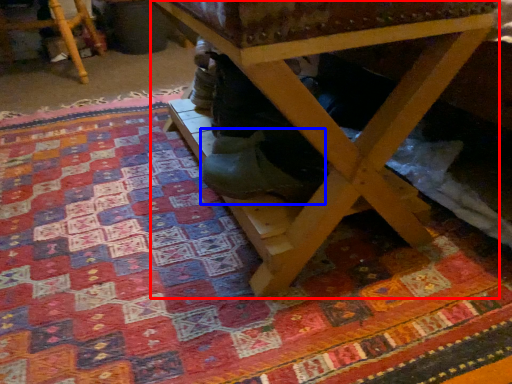
Question: Among these objects, which one is nearest to the camera, table (highlighted by a red box) or shoe (highlighted by a blue box)?

Choices:
 (A) table
 (B) shoe

Answer: (A)